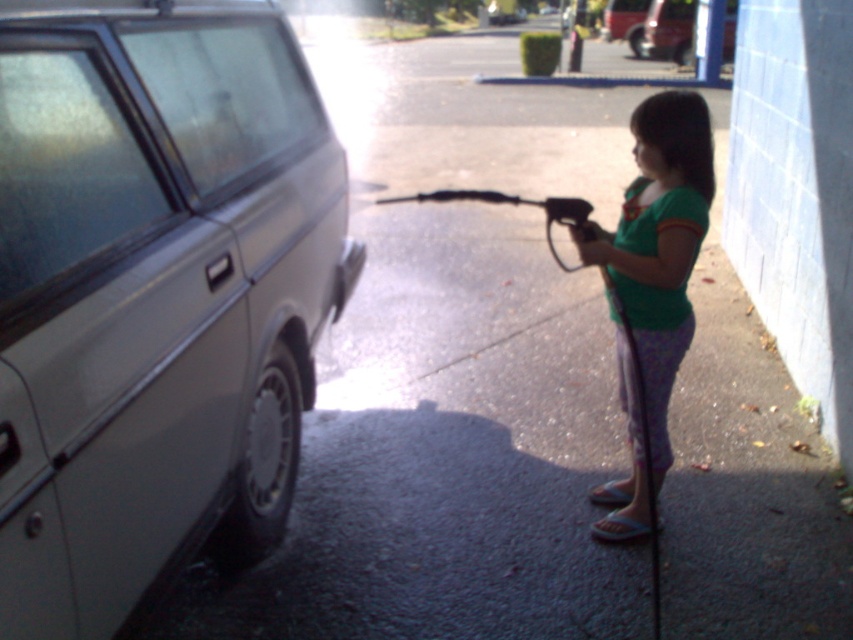
Question: Considering the relative positions of matte silver minivan at left and green fabric shirt at right in the image provided, where is matte silver minivan at left located with respect to green fabric shirt at right?

Choices:
 (A) above
 (B) below

Answer: (A)

Question: In this image, where is matte silver minivan at left located relative to metallic silver car at center?

Choices:
 (A) above
 (B) below

Answer: (B)

Question: Considering the real-world distances, which object is closest to the metallic silver car at upper center?

Choices:
 (A) matte silver minivan at left
 (B) metallic silver car at center
 (C) black rubber hose at center

Answer: (B)

Question: Can you confirm if green fabric shirt at right is positioned above metallic silver car at center?

Choices:
 (A) yes
 (B) no

Answer: (B)

Question: Which of the following is the closest to the observer?

Choices:
 (A) metallic silver car at center
 (B) metallic silver car at upper center
 (C) green fabric shirt at right
 (D) black rubber hose at center

Answer: (C)

Question: Based on their relative distances, which object is nearer to the metallic silver car at upper center?

Choices:
 (A) matte silver minivan at left
 (B) black rubber hose at center
 (C) green fabric shirt at right
 (D) metallic silver car at center

Answer: (D)